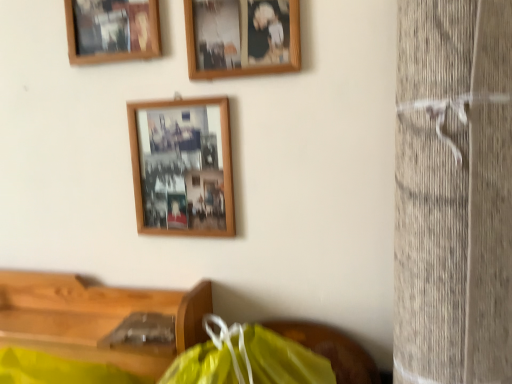
This screenshot has height=384, width=512. I want to click on wooden photo frame at upper center, the second picture frame when ordered from top to bottom, so click(242, 37).

Locate an element on the screen. Image resolution: width=512 pixels, height=384 pixels. wooden photo frame at center, the first picture frame positioned from the bottom is located at coordinates (182, 167).

Find the location of a particular element. wooden picture frame at upper left, positioned as the 3th picture frame in bottom-to-top order is located at coordinates (112, 30).

In order to click on wooden table at lower left in this screenshot , I will do `click(95, 318)`.

Considering the positions of points (71, 10) and (139, 135), is point (71, 10) closer to camera compared to point (139, 135)?

No, (71, 10) is further to viewer.

Does wooden picture frame at upper left, acting as the 1th picture frame starting from the top, appear on the left side of wooden photo frame at center, the first picture frame positioned from the bottom?

Yes.

From a real-world perspective, who is located lower, wooden picture frame at upper left, positioned as the 3th picture frame in bottom-to-top order, or wooden photo frame at center, which appears as the third picture frame when viewed from the top?

wooden photo frame at center, which appears as the third picture frame when viewed from the top, is physically lower.

Considering the sizes of objects wooden picture frame at upper left, positioned as the 3th picture frame in bottom-to-top order, and wooden photo frame at center, the first picture frame positioned from the bottom, in the image provided, who is smaller, wooden picture frame at upper left, positioned as the 3th picture frame in bottom-to-top order, or wooden photo frame at center, the first picture frame positioned from the bottom,?

wooden picture frame at upper left, positioned as the 3th picture frame in bottom-to-top order.

I want to click on the 1st picture frame behind the wooden photo frame at upper center, positioned as the 2th picture frame in bottom-to-top order, starting your count from the anchor, so click(112, 30).

Can you confirm if wooden photo frame at upper center, positioned as the 2th picture frame in bottom-to-top order, is positioned to the left of wooden picture frame at upper left, acting as the 1th picture frame starting from the top?

Incorrect, wooden photo frame at upper center, positioned as the 2th picture frame in bottom-to-top order, is not on the left side of wooden picture frame at upper left, acting as the 1th picture frame starting from the top.

Is wooden photo frame at upper center, positioned as the 2th picture frame in bottom-to-top order, situated inside wooden picture frame at upper left, acting as the 1th picture frame starting from the top, or outside?

wooden photo frame at upper center, positioned as the 2th picture frame in bottom-to-top order, exists outside the volume of wooden picture frame at upper left, acting as the 1th picture frame starting from the top.

Considering the sizes of wooden photo frame at center, which appears as the third picture frame when viewed from the top, and wooden picture frame at upper left, acting as the 1th picture frame starting from the top, in the image, is wooden photo frame at center, which appears as the third picture frame when viewed from the top, taller or shorter than wooden picture frame at upper left, acting as the 1th picture frame starting from the top,?

Clearly, wooden photo frame at center, which appears as the third picture frame when viewed from the top, is shorter compared to wooden picture frame at upper left, acting as the 1th picture frame starting from the top.

Which is closer to the camera, [192,220] or [89,43]?

The point [192,220] is closer to the camera.

How many degrees apart are the facing directions of wooden photo frame at center, the first picture frame positioned from the bottom, and wooden picture frame at upper left, positioned as the 3th picture frame in bottom-to-top order?

1.9 degrees separate the facing orientations of wooden photo frame at center, the first picture frame positioned from the bottom, and wooden picture frame at upper left, positioned as the 3th picture frame in bottom-to-top order.

Is wooden photo frame at center, which appears as the third picture frame when viewed from the top, behind wooden picture frame at upper left, acting as the 1th picture frame starting from the top?

Yes, the depth of wooden photo frame at center, which appears as the third picture frame when viewed from the top, is greater than that of wooden picture frame at upper left, acting as the 1th picture frame starting from the top.

Considering the positions of objects wooden photo frame at center, the first picture frame positioned from the bottom, and wooden photo frame at upper center, the second picture frame when ordered from top to bottom, in the image provided, who is more to the left, wooden photo frame at center, the first picture frame positioned from the bottom, or wooden photo frame at upper center, the second picture frame when ordered from top to bottom,?

From the viewer's perspective, wooden photo frame at center, the first picture frame positioned from the bottom, appears more on the left side.

Which is further, (135, 178) or (196, 30)?

The point (135, 178) is behind.

Do you think wooden photo frame at center, the first picture frame positioned from the bottom, is within wooden photo frame at upper center, the second picture frame when ordered from top to bottom, or outside of it?

wooden photo frame at center, the first picture frame positioned from the bottom, is outside wooden photo frame at upper center, the second picture frame when ordered from top to bottom.

How many degrees apart are the facing directions of wooden photo frame at center, which appears as the third picture frame when viewed from the top, and wooden photo frame at upper center, positioned as the 2th picture frame in bottom-to-top order?

0.186 degrees separate the facing orientations of wooden photo frame at center, which appears as the third picture frame when viewed from the top, and wooden photo frame at upper center, positioned as the 2th picture frame in bottom-to-top order.

Consider the image. Does wooden picture frame at upper left, acting as the 1th picture frame starting from the top, have a greater width compared to wooden photo frame at upper center, positioned as the 2th picture frame in bottom-to-top order?

Yes, wooden picture frame at upper left, acting as the 1th picture frame starting from the top, is wider than wooden photo frame at upper center, positioned as the 2th picture frame in bottom-to-top order.

From the image's perspective, is wooden picture frame at upper left, positioned as the 3th picture frame in bottom-to-top order, beneath wooden photo frame at upper center, the second picture frame when ordered from top to bottom?

No.

From a real-world perspective, which object stands above the other?

wooden picture frame at upper left, positioned as the 3th picture frame in bottom-to-top order.

From the image's perspective, relative to wooden picture frame at upper left, positioned as the 3th picture frame in bottom-to-top order, is wooden table at lower left above or below?

Clearly, from the image's perspective, wooden table at lower left is below wooden picture frame at upper left, positioned as the 3th picture frame in bottom-to-top order.

Where is `picture frame that is the 3rd object located above the wooden table at lower left (from the image's perspective)`? The image size is (512, 384). picture frame that is the 3rd object located above the wooden table at lower left (from the image's perspective) is located at coordinates (112, 30).

Between wooden table at lower left and wooden picture frame at upper left, positioned as the 3th picture frame in bottom-to-top order, which one appears on the left side from the viewer's perspective?

From the viewer's perspective, wooden picture frame at upper left, positioned as the 3th picture frame in bottom-to-top order, appears more on the left side.

Based on the photo, considering the relative sizes of wooden table at lower left and wooden picture frame at upper left, positioned as the 3th picture frame in bottom-to-top order, in the image provided, is wooden table at lower left taller than wooden picture frame at upper left, positioned as the 3th picture frame in bottom-to-top order,?

In fact, wooden table at lower left may be shorter than wooden picture frame at upper left, positioned as the 3th picture frame in bottom-to-top order.

Looking at this image, between wooden table at lower left and wooden photo frame at upper center, positioned as the 2th picture frame in bottom-to-top order, which one appears on the left side from the viewer's perspective?

wooden table at lower left is more to the left.

Which is behind, wooden table at lower left or wooden photo frame at upper center, the second picture frame when ordered from top to bottom?

wooden photo frame at upper center, the second picture frame when ordered from top to bottom, is further away from the camera.

Considering the sizes of wooden table at lower left and wooden photo frame at upper center, positioned as the 2th picture frame in bottom-to-top order, in the image, is wooden table at lower left bigger or smaller than wooden photo frame at upper center, positioned as the 2th picture frame in bottom-to-top order,?

Considering their sizes, wooden table at lower left takes up more space than wooden photo frame at upper center, positioned as the 2th picture frame in bottom-to-top order.

Can you confirm if wooden table at lower left is taller than wooden photo frame at upper center, the second picture frame when ordered from top to bottom?

In fact, wooden table at lower left may be shorter than wooden photo frame at upper center, the second picture frame when ordered from top to bottom.

You are a GUI agent. You are given a task and a screenshot of the screen. Output one action in this format:
    pyautogui.click(x=<x>, y=<y>)
    Task: Click on the picture frame behind the wooden picture frame at upper left, positioned as the 3th picture frame in bottom-to-top order
    This screenshot has height=384, width=512.
    Given the screenshot: What is the action you would take?
    pyautogui.click(x=182, y=167)

From the wooden photo frame at upper center, the second picture frame when ordered from top to bottom, count the 2nd picture frame to the left and point to it. Please provide its 2D coordinates.

[(112, 30)]

From the image, which object appears to be farther from wooden photo frame at center, which appears as the third picture frame when viewed from the top, wooden table at lower left or wooden photo frame at upper center, the second picture frame when ordered from top to bottom?

wooden table at lower left lies further to wooden photo frame at center, which appears as the third picture frame when viewed from the top, than the other object.

Estimate the real-world distances between objects in this image. Which object is further from wooden picture frame at upper left, positioned as the 3th picture frame in bottom-to-top order, wooden photo frame at center, which appears as the third picture frame when viewed from the top, or wooden table at lower left?

The object further to wooden picture frame at upper left, positioned as the 3th picture frame in bottom-to-top order, is wooden table at lower left.

From the image, which object appears to be farther from wooden picture frame at upper left, positioned as the 3th picture frame in bottom-to-top order, wooden photo frame at upper center, the second picture frame when ordered from top to bottom, or wooden photo frame at center, the first picture frame positioned from the bottom?

Among the two, wooden photo frame at center, the first picture frame positioned from the bottom, is located further to wooden picture frame at upper left, positioned as the 3th picture frame in bottom-to-top order.

Estimate the real-world distances between objects in this image. Which object is further from wooden photo frame at upper center, the second picture frame when ordered from top to bottom, wooden photo frame at center, the first picture frame positioned from the bottom, or wooden picture frame at upper left, positioned as the 3th picture frame in bottom-to-top order?

wooden picture frame at upper left, positioned as the 3th picture frame in bottom-to-top order, is positioned further to the anchor wooden photo frame at upper center, the second picture frame when ordered from top to bottom.

Based on their spatial positions, is wooden picture frame at upper left, acting as the 1th picture frame starting from the top, or wooden photo frame at center, which appears as the third picture frame when viewed from the top, further from wooden table at lower left?

wooden picture frame at upper left, acting as the 1th picture frame starting from the top, is positioned further to the anchor wooden table at lower left.

Which object lies further to the anchor point wooden photo frame at center, which appears as the third picture frame when viewed from the top, wooden photo frame at upper center, the second picture frame when ordered from top to bottom, or wooden picture frame at upper left, acting as the 1th picture frame starting from the top?

Based on the image, wooden picture frame at upper left, acting as the 1th picture frame starting from the top, appears to be further to wooden photo frame at center, which appears as the third picture frame when viewed from the top.

From the image, which object appears to be nearer to wooden picture frame at upper left, positioned as the 3th picture frame in bottom-to-top order, wooden table at lower left or wooden photo frame at upper center, positioned as the 2th picture frame in bottom-to-top order?

wooden photo frame at upper center, positioned as the 2th picture frame in bottom-to-top order, lies closer to wooden picture frame at upper left, positioned as the 3th picture frame in bottom-to-top order, than the other object.

From the image, which object appears to be nearer to wooden picture frame at upper left, positioned as the 3th picture frame in bottom-to-top order, wooden photo frame at center, the first picture frame positioned from the bottom, or wooden photo frame at upper center, the second picture frame when ordered from top to bottom?

wooden photo frame at upper center, the second picture frame when ordered from top to bottom, is positioned closer to the anchor wooden picture frame at upper left, positioned as the 3th picture frame in bottom-to-top order.

At what (x,y) coordinates should I click in order to perform the action: click on picture frame between wooden photo frame at upper center, positioned as the 2th picture frame in bottom-to-top order, and wooden table at lower left from top to bottom. Please return your answer as a coordinate pair (x, y). Looking at the image, I should click on (182, 167).

Find the location of a particular element. This screenshot has width=512, height=384. picture frame between wooden picture frame at upper left, acting as the 1th picture frame starting from the top, and wooden photo frame at center, the first picture frame positioned from the bottom, from top to bottom is located at coordinates (242, 37).